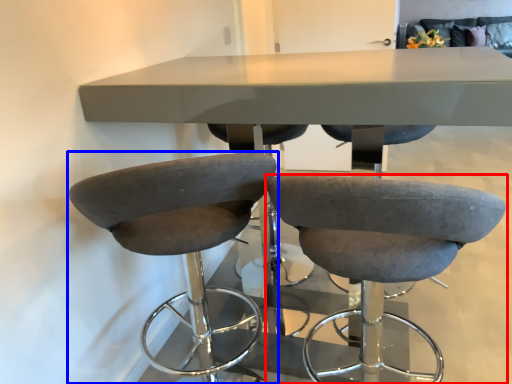
Question: Which object appears farthest to the camera in this image, chair (highlighted by a red box) or chair (highlighted by a blue box)?

Choices:
 (A) chair
 (B) chair

Answer: (B)